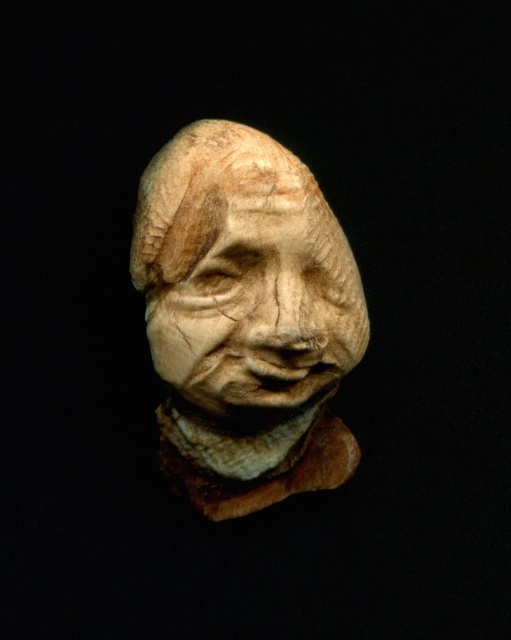
You are an art conservator examining the sculpture. You notice two parts of the sculpture, the matte beige stone head at center and the matte beige sculpture at center. Which part is closer to you?

The matte beige stone head at center is closer to you than the matte beige sculpture at center.

You are an art conservator examining the matte beige stone head at center. Based on its 2D location coordinates, can you determine if it is positioned exactly at the center of the image?

The 2D location coordinates of the matte beige stone head at center are at point [245,317], which is very close to the exact center of the image. Therefore, it can be considered positioned at the center.